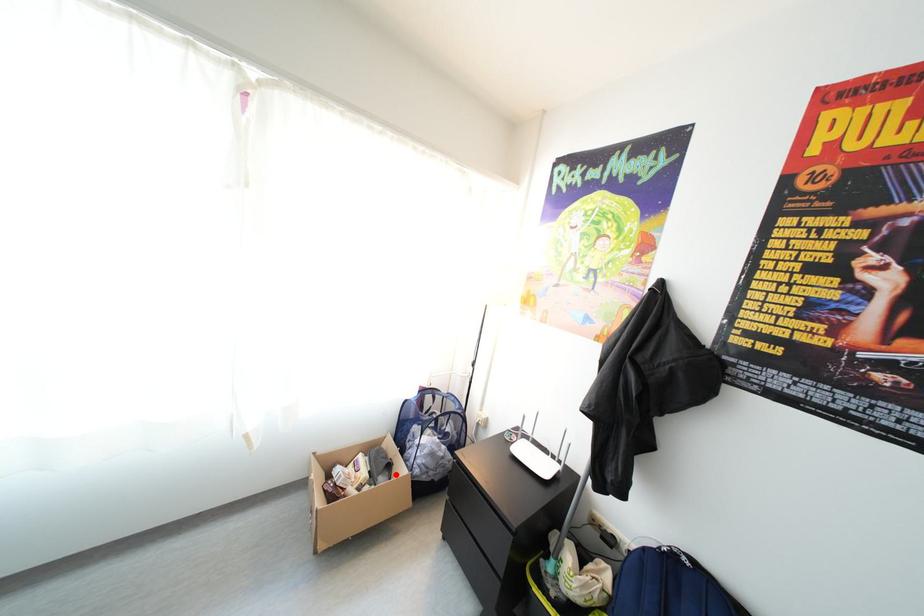
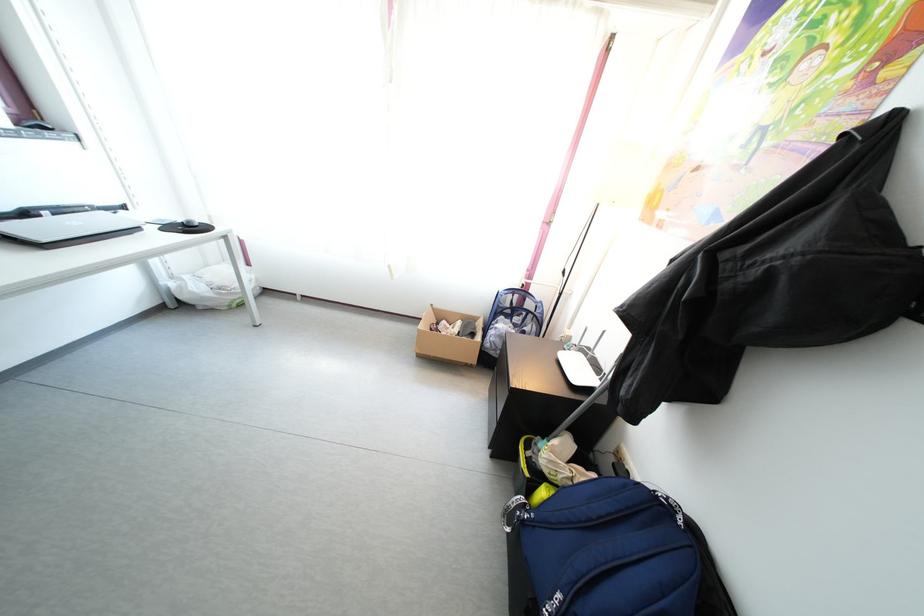
Question: I am providing you with two images of the same scene from different viewpoints. Given a red point in image1, look at the same physical point in image2. Is it:

Choices:
 (A) Closer to the viewpoint
 (B) Farther from the viewpoint

Answer: (A)